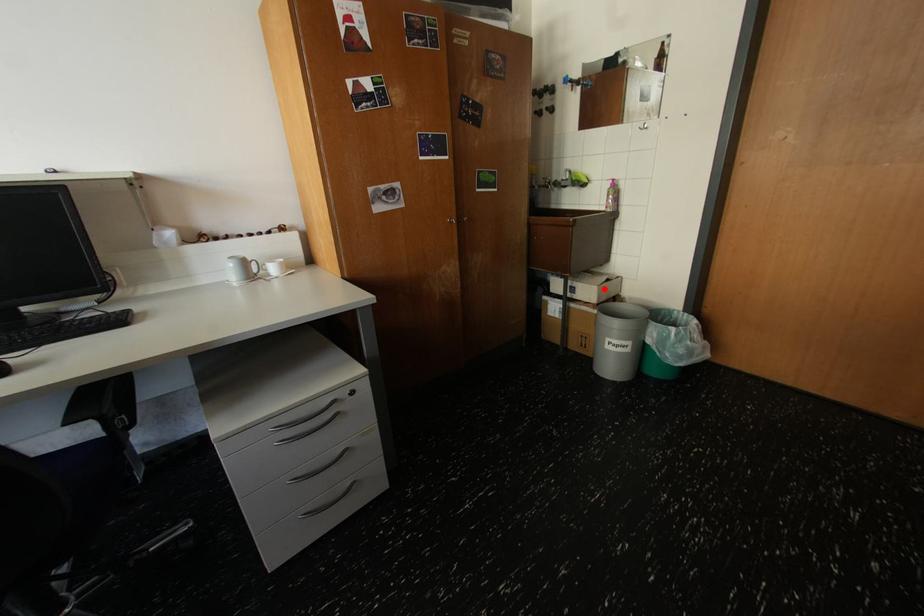
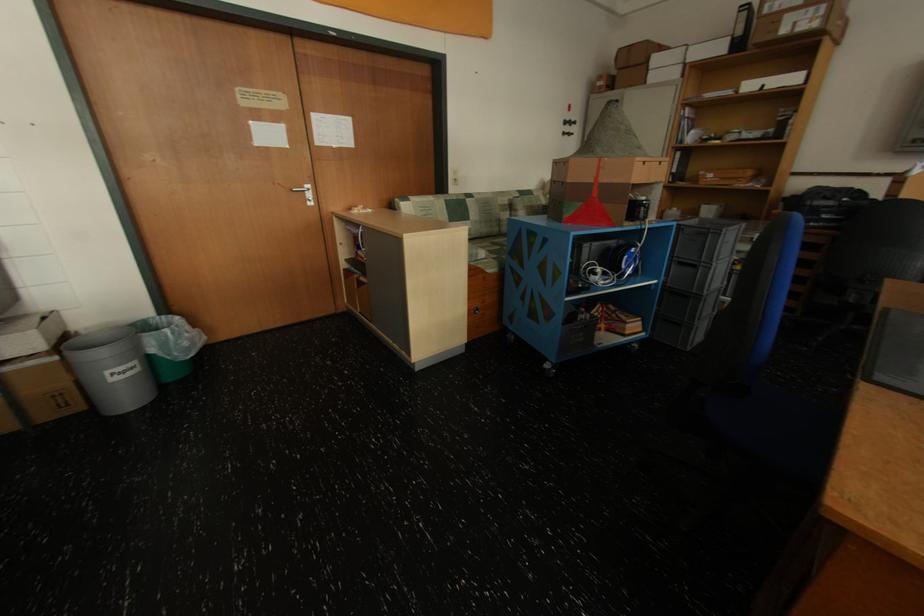
Question: I am providing you with two images of the same scene from different viewpoints. Image1 has a red point marked. In image2, the corresponding 3D location appears at what relative position? Reply with the corresponding letter.

Choices:
 (A) Closer
 (B) Farther

Answer: (B)